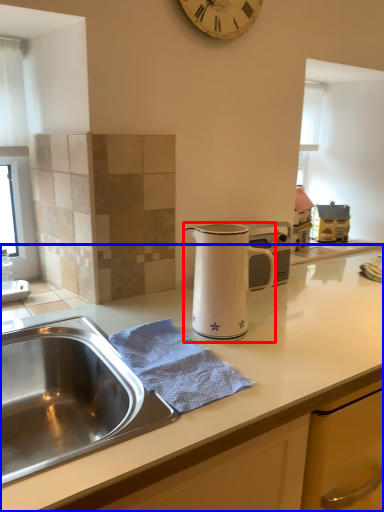
Question: Which point is closer to the camera, jug (highlighted by a red box) or countertop (highlighted by a blue box)?

Choices:
 (A) jug
 (B) countertop

Answer: (B)